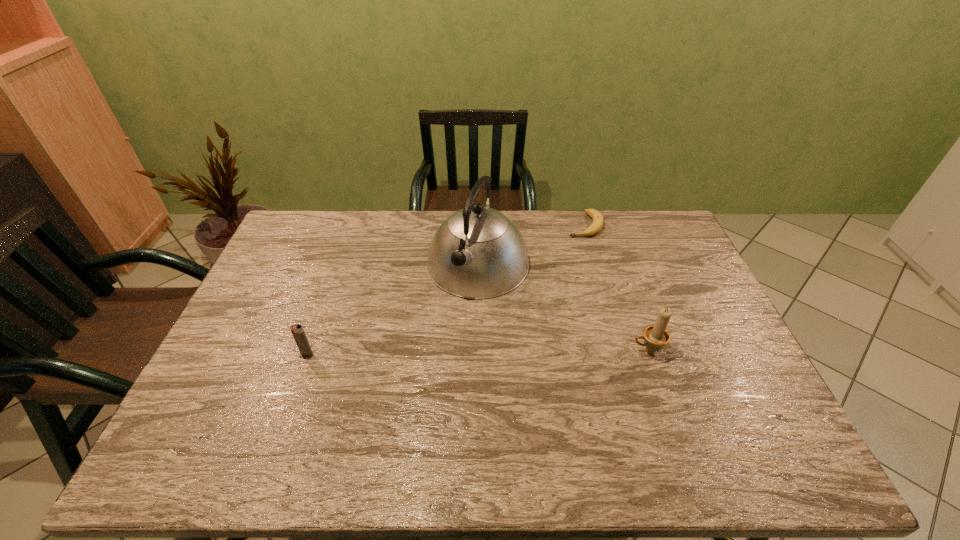
Image resolution: width=960 pixels, height=540 pixels. What are the coordinates of `free space located 0.110m at the stem of the banana` in the screenshot? It's located at (572, 255).

Locate an element on the screen. The image size is (960, 540). blank area located 0.180m at the stem of the banana is located at coordinates (566, 267).

You are a GUI agent. You are given a task and a screenshot of the screen. Output one action in this format:
    pyautogui.click(x=<x>, y=<y>)
    Task: Click on the vacant space located at the stem of the banana
    The image size is (960, 540).
    Given the screenshot: What is the action you would take?
    pyautogui.click(x=556, y=290)

This screenshot has width=960, height=540. Find the location of `vacant space located 0.090m from the spout of the tallest object`. vacant space located 0.090m from the spout of the tallest object is located at coordinates (449, 320).

Identify the location of free space located from the spout of the tallest object. This screenshot has height=540, width=960. (451, 318).

Find the location of `free space located 0.120m from the spout of the tallest object`. free space located 0.120m from the spout of the tallest object is located at coordinates (445, 327).

The height and width of the screenshot is (540, 960). Find the location of `banana situated at the far edge`. banana situated at the far edge is located at coordinates (598, 221).

Locate an element on the screen. Image resolution: width=960 pixels, height=540 pixels. kettle that is at the far edge is located at coordinates (477, 253).

In the image, there is a desktop. At what (x,y) coordinates should I click in order to perform the action: click on free region at the far edge. Please return your answer as a coordinate pair (x, y). This screenshot has width=960, height=540. Looking at the image, I should click on (427, 220).

Image resolution: width=960 pixels, height=540 pixels. I want to click on vacant space at the near edge, so click(380, 407).